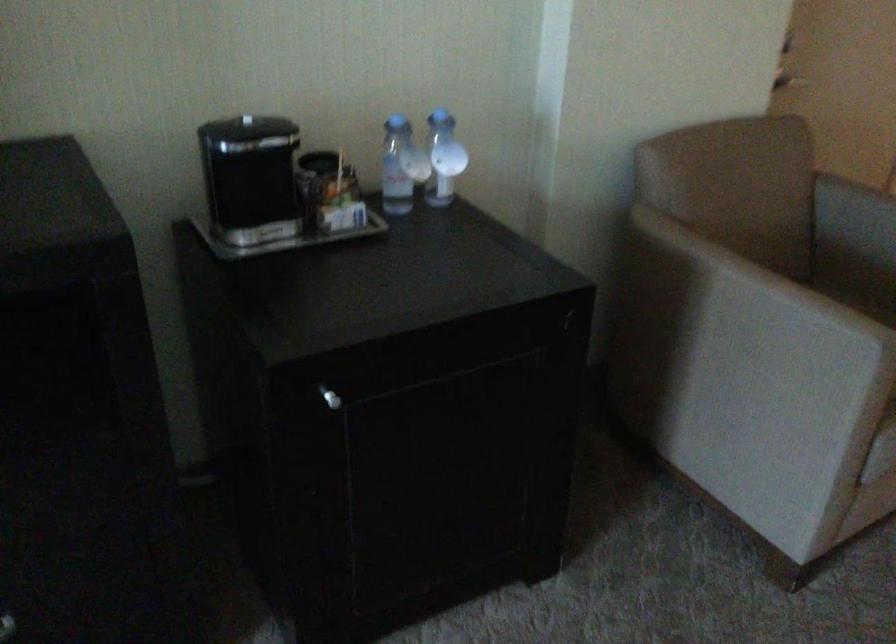
Find where to lift the black coffee maker lid. Please return your answer as a coordinate pair (x, y).

(246, 120)